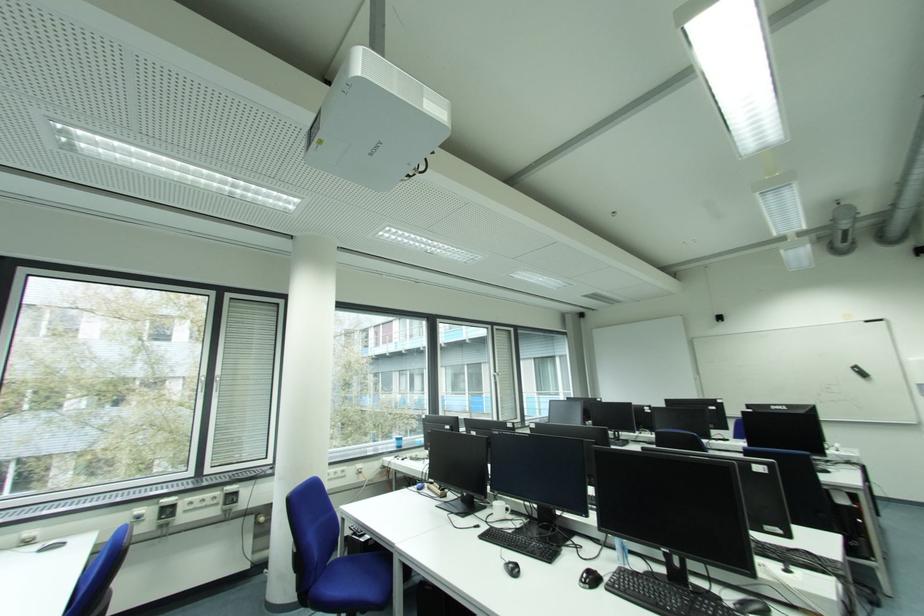
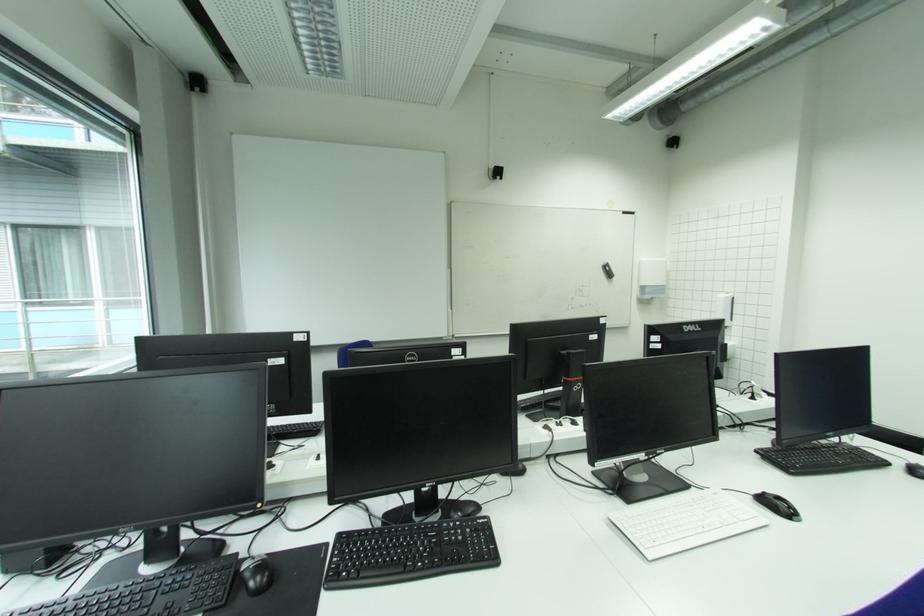
The point at [858,367] is marked in the first image. Where is the corresponding point in the second image?

(610, 264)